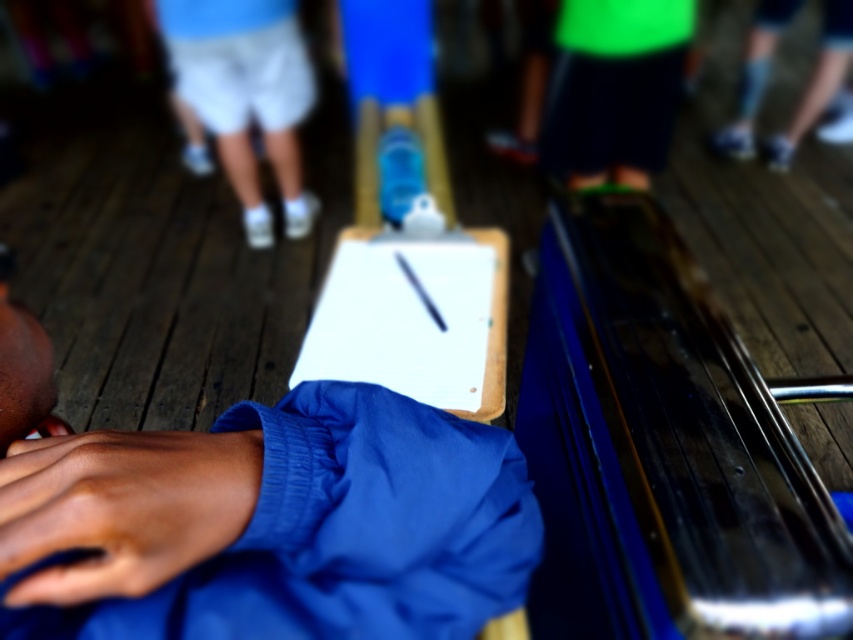
Is the position of blue fabric shirt at center more distant than that of white cotton shorts at upper center?

No, blue fabric shirt at center is in front of white cotton shorts at upper center.

Between blue fabric shirt at center and white cotton shorts at upper center, which one has less height?

blue fabric shirt at center is shorter.

Which is in front, point (22, 516) or point (236, 145)?

Positioned in front is point (22, 516).

This screenshot has height=640, width=853. What are the coordinates of `blue fabric shirt at center` in the screenshot? It's located at (271, 522).

Does blue fabric shirt at center have a greater height compared to dark skin hand at lower left?

Indeed, blue fabric shirt at center has a greater height compared to dark skin hand at lower left.

Is blue fabric shirt at center above dark skin hand at lower left?

Actually, blue fabric shirt at center is below dark skin hand at lower left.

Which is behind, point (453, 490) or point (41, 497)?

The point (453, 490) is behind.

Where is `blue fabric shirt at center`? Image resolution: width=853 pixels, height=640 pixels. blue fabric shirt at center is located at coordinates (271, 522).

Who is positioned more to the left, dark skin hand at lower left or white paperboard at center?

dark skin hand at lower left is more to the left.

Is point (132, 531) more distant than point (404, 349)?

No, it is not.

I want to click on dark skin hand at lower left, so click(120, 508).